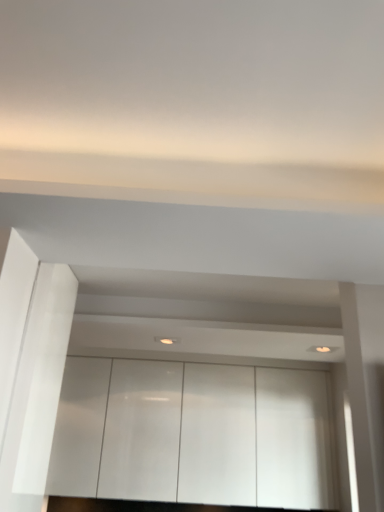
The height and width of the screenshot is (512, 384). Find the location of `white glossy cabinet at center`. white glossy cabinet at center is located at coordinates (193, 434).

Describe the element at coordinates (193, 434) in the screenshot. I see `white glossy cabinet at center` at that location.

This screenshot has width=384, height=512. What are the coordinates of `white glossy cabinet at center` in the screenshot? It's located at (193, 434).